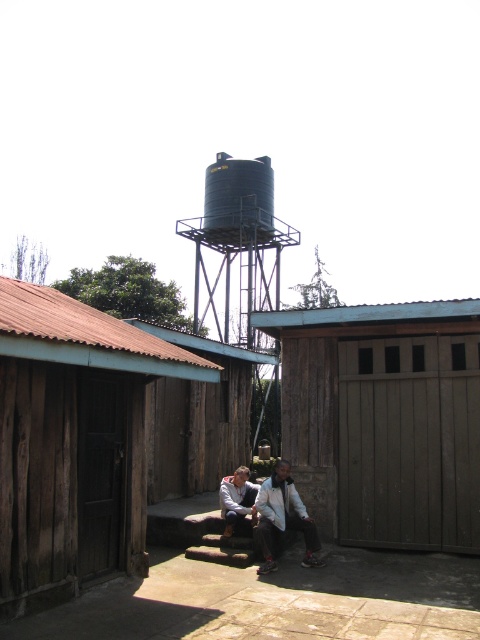
Question: Which object is positioned closest to the blue matte water tower at center?

Choices:
 (A) light gray fabric jacket at center
 (B) wooden hut at center
 (C) black matte silo at upper center
 (D) wooden hut at left

Answer: (C)

Question: Which point is closer to the camera?

Choices:
 (A) blue matte water tower at center
 (B) black matte silo at upper center
 (C) light gray fabric jacket at center

Answer: (C)

Question: Can you confirm if blue matte water tower at center is thinner than black matte silo at upper center?

Choices:
 (A) no
 (B) yes

Answer: (A)

Question: Based on their relative distances, which object is farther from the black matte silo at upper center?

Choices:
 (A) white cotton shirt at center
 (B) wooden hut at left

Answer: (B)

Question: Can you confirm if blue matte water tower at center is positioned below light gray fabric jacket at center?

Choices:
 (A) no
 (B) yes

Answer: (A)

Question: Can you confirm if blue matte water tower at center is thinner than white cotton shirt at center?

Choices:
 (A) yes
 (B) no

Answer: (B)